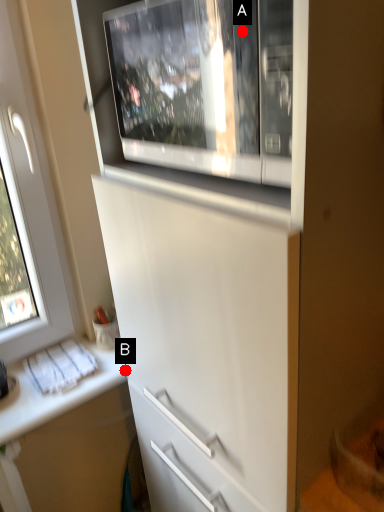
Question: Two points are circled on the image, labeled by A and B beside each circle. Which point is farther to the camera?

Choices:
 (A) A is further
 (B) B is further

Answer: (B)